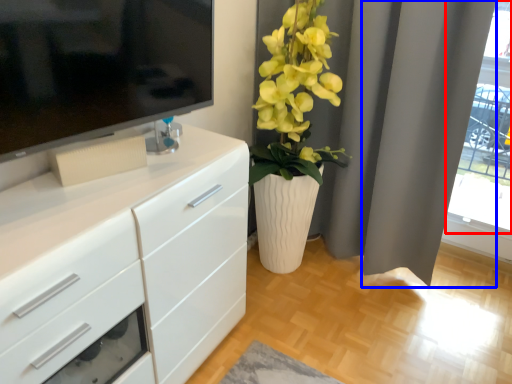
Question: Which object appears farthest to the camera in this image, glass door (highlighted by a red box) or curtain (highlighted by a blue box)?

Choices:
 (A) glass door
 (B) curtain

Answer: (A)